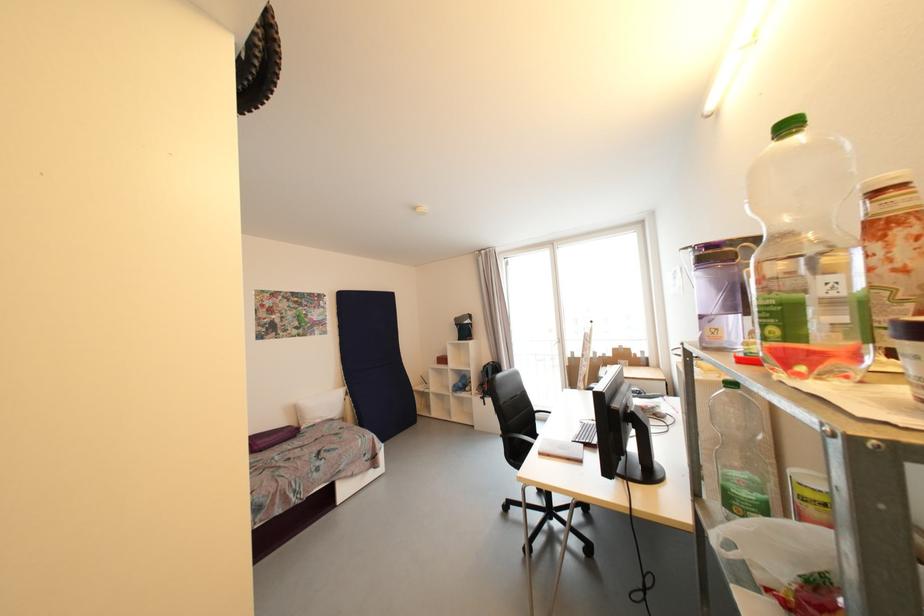
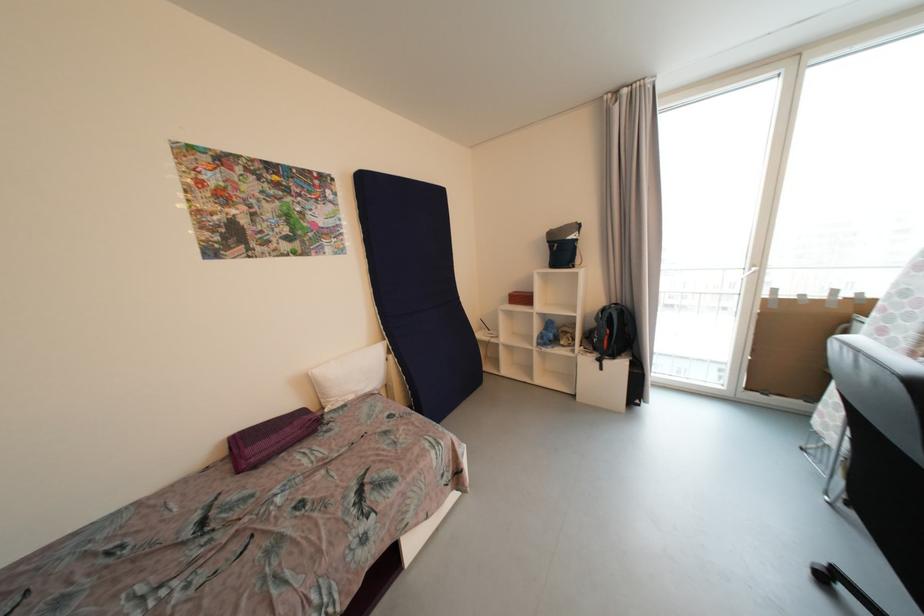
In a continuous first-person perspective shot, in which direction is the camera moving?

The movement direction of the cameraman is left, forward.